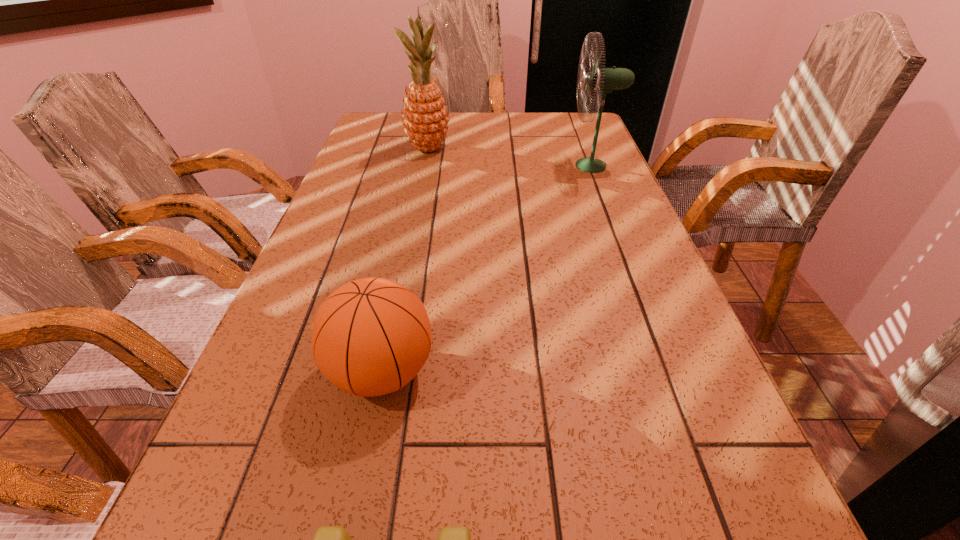
The image size is (960, 540). I want to click on vacant area that lies between the pineapple and the basketball, so click(405, 260).

Where is `free area in between the pineapple and the rightmost object`? The width and height of the screenshot is (960, 540). free area in between the pineapple and the rightmost object is located at coordinates (510, 157).

Point out which object is positioned as the third nearest to the shortest object. Please provide its 2D coordinates. Your answer should be formatted as a tuple, i.e. [(x, y)], where the tuple contains the x and y coordinates of a point satisfying the conditions above.

[(425, 118)]

Where is `object identified as the closest to the pineapple`? Image resolution: width=960 pixels, height=540 pixels. object identified as the closest to the pineapple is located at coordinates (602, 80).

The height and width of the screenshot is (540, 960). What are the coordinates of `vacant space that satisfies the following two spatial constraints: 1. on the front-facing side of the fan; 2. on the front side of the basketball` in the screenshot? It's located at tap(672, 372).

This screenshot has height=540, width=960. Identify the location of free space that satisfies the following two spatial constraints: 1. on the back side of the third tallest object; 2. on the left side of the pineapple. point(426,148).